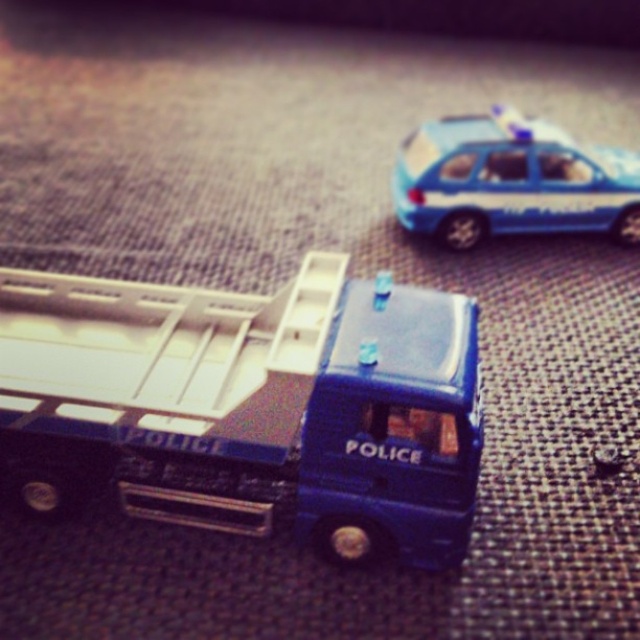
Is blue metallic truck at center thinner than blue plastic car at upper right?

No.

Is blue metallic truck at center positioned behind blue plastic car at upper right?

No, it is not.

Between point (412, 288) and point (586, 172), which one is positioned behind?

Positioned behind is point (586, 172).

Find the location of a particular element. This screenshot has width=640, height=640. blue metallic truck at center is located at coordinates (268, 390).